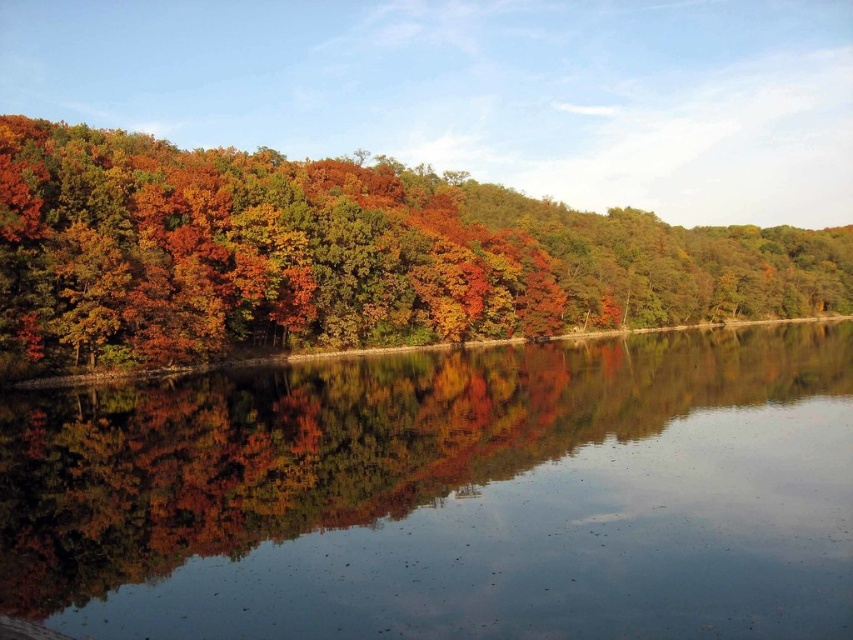
You are an artist who wants to paint the autumn scene. You notice the transparent water at center and autumn leaves at left in the image. Which object is located below the other?

The transparent water at center is positioned under autumn leaves at left, so the water is below the leaves.

You are standing at point (363, 532) and want to reach the opposite side of the water body. The path you need to take is 19.51 meters long. If your walking speed is 1.5 meters per second, how many seconds will it take you to cross the water body?

The path between the two points is 19.51 meters long. At a walking speed of 1.5 meters per second, it will take approximately 13 seconds to cross the water body.

You are standing on a path near the water and want to place a small decorative rock between the transparent water at center and the autumn leaves at left. Based on their positions, where should you place the rock?

The transparent water at center is positioned on the left side of autumn leaves at left, so you should place the rock to the left of the autumn leaves at left to position it between them.